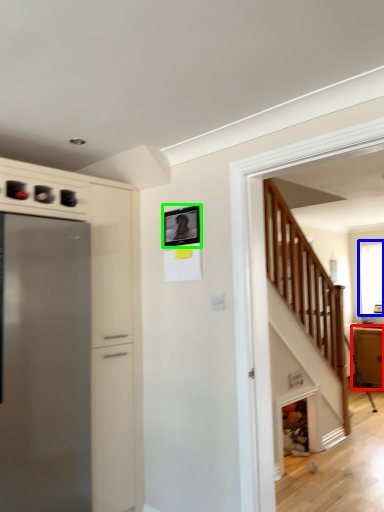
Question: Which object is the farthest from cabinetry (highlighted by a red box)? Choose among these: window (highlighted by a blue box) or picture frame (highlighted by a green box).

Choices:
 (A) window
 (B) picture frame

Answer: (B)